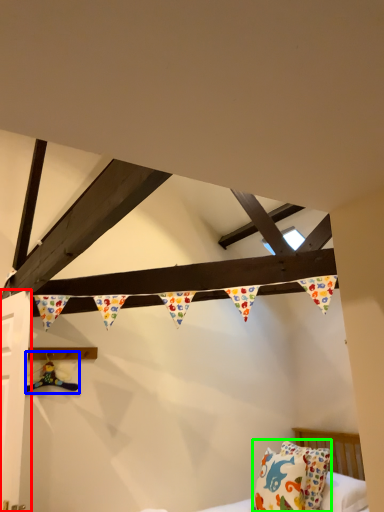
Question: Estimate the real-world distances between objects in this image. Which object is closer to door (highlighted by a red box), toy (highlighted by a blue box) or pillow (highlighted by a green box)?

Choices:
 (A) toy
 (B) pillow

Answer: (A)